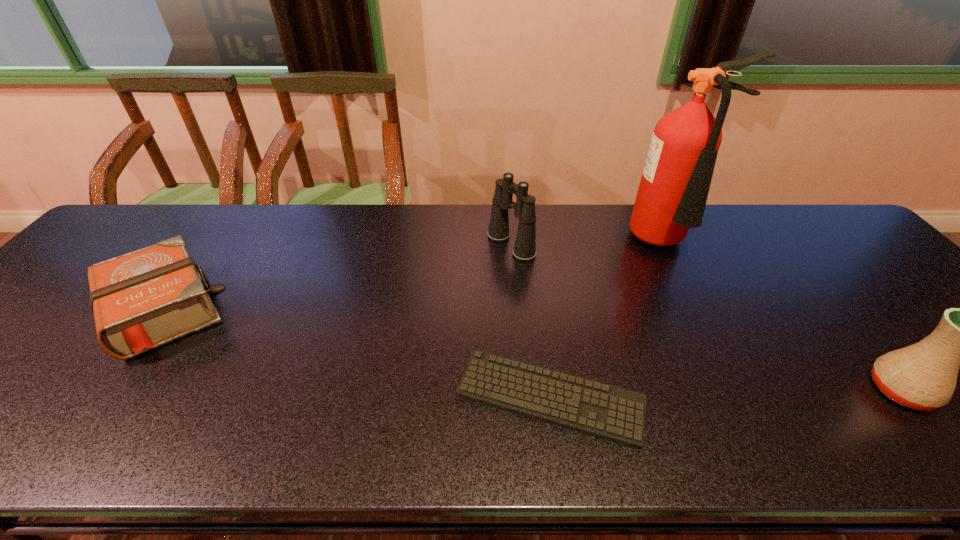
This screenshot has width=960, height=540. I want to click on the tallest object, so click(672, 194).

Where is `the fourth object from left to right`? The image size is (960, 540). the fourth object from left to right is located at coordinates (672, 194).

You are a GUI agent. You are given a task and a screenshot of the screen. Output one action in this format:
    pyautogui.click(x=<x>, y=<y>)
    Task: Click on the binoculars
    The height and width of the screenshot is (540, 960).
    Given the screenshot: What is the action you would take?
    pyautogui.click(x=524, y=249)

Identify the location of pottery. The height and width of the screenshot is (540, 960). (923, 376).

Where is `the fourth tallest object`? This screenshot has width=960, height=540. the fourth tallest object is located at coordinates (141, 300).

Find the location of `the leftmost object`. the leftmost object is located at coordinates (141, 300).

At what (x,y) coordinates should I click in order to perform the action: click on computer keyboard. Please return your answer as a coordinate pair (x, y). The width and height of the screenshot is (960, 540). Looking at the image, I should click on (615, 414).

At what (x,y) coordinates should I click in order to perform the action: click on blank area located 0.070m at the nozzle of the fourth object from left to right. Please return your answer as a coordinate pair (x, y). This screenshot has height=540, width=960. Looking at the image, I should click on (691, 288).

Identify the location of vacant space situated 0.180m on the right of the binoculars. This screenshot has width=960, height=540. (596, 245).

The height and width of the screenshot is (540, 960). I want to click on free location located on the back of the pottery, so click(839, 315).